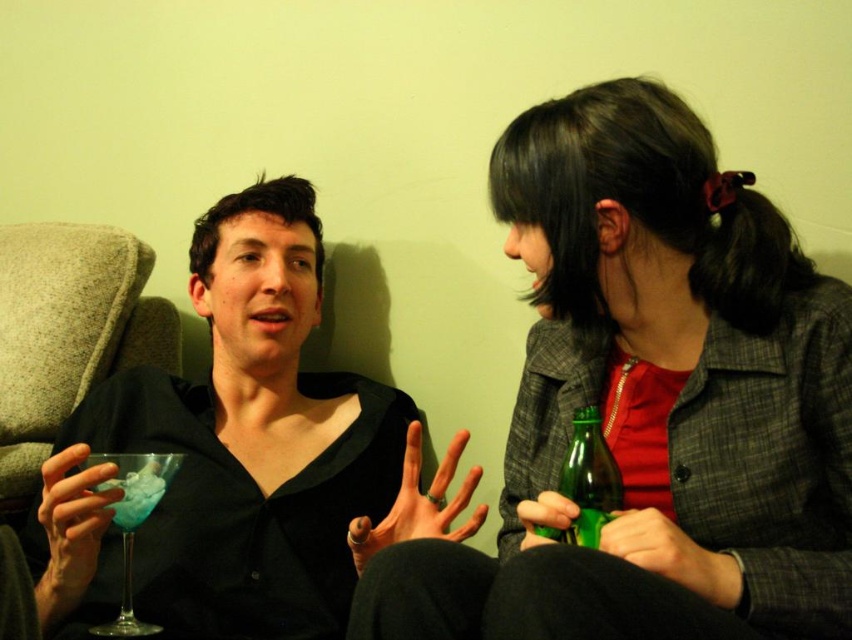
Does plaid fabric jacket at center have a smaller size compared to green glass bottle at right?

No, plaid fabric jacket at center is not smaller than green glass bottle at right.

Is plaid fabric jacket at center bigger than green glass bottle at right?

Yes.

This screenshot has height=640, width=852. What are the coordinates of `plaid fabric jacket at center` in the screenshot? It's located at (652, 401).

Measure the distance between point (x=707, y=220) and camera.

Point (x=707, y=220) and camera are 36.18 inches apart from each other.

Between plaid fabric jacket at center and matte black shirt at left, which one appears on the right side from the viewer's perspective?

plaid fabric jacket at center is more to the right.

Measure the distance between plaid fabric jacket at center and camera.

plaid fabric jacket at center and camera are 60.17 centimeters apart.

At what (x,y) coordinates should I click in order to perform the action: click on plaid fabric jacket at center. Please return your answer as a coordinate pair (x, y). The height and width of the screenshot is (640, 852). Looking at the image, I should click on (652, 401).

Which is below, green glass bottle at right or translucent glass at left?

translucent glass at left

Is green glass bottle at right wider than translucent glass at left?

Correct, the width of green glass bottle at right exceeds that of translucent glass at left.

Does point (556, 540) come behind point (127, 483)?

No, it is not.

The width and height of the screenshot is (852, 640). I want to click on green glass bottle at right, so click(586, 481).